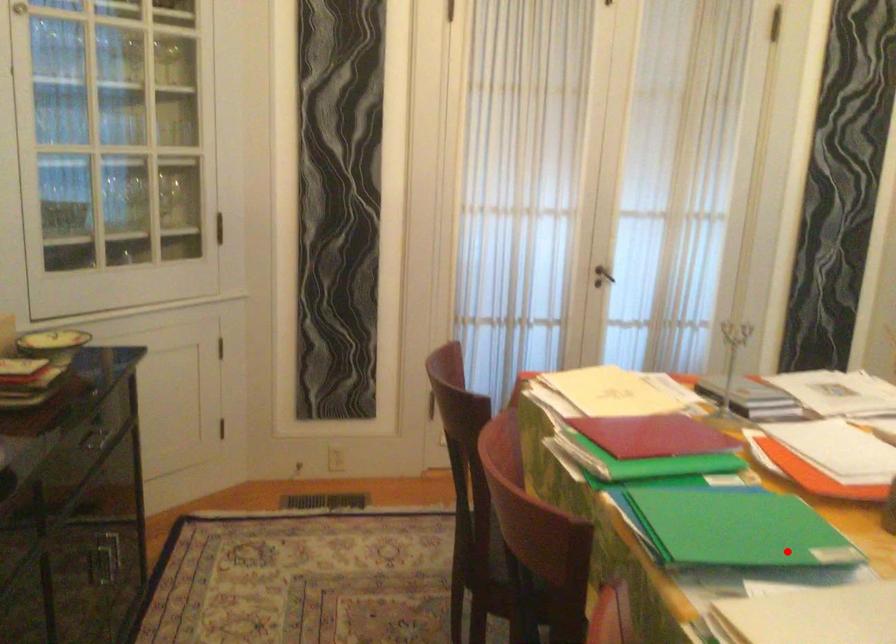
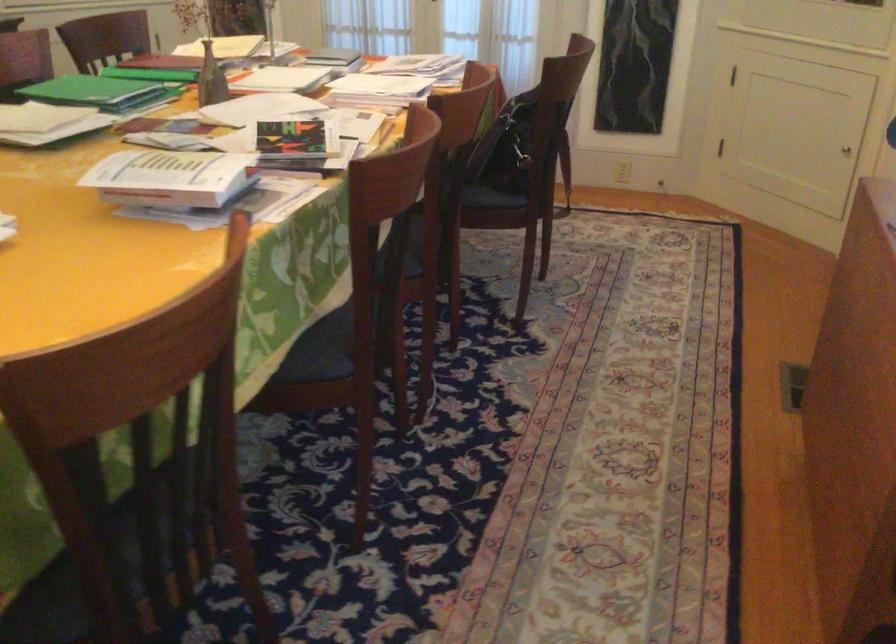
Question: I am providing you with two images of the same scene from different viewpoints. A red point is marked on the first image. Is the red point's position out of view in image 2?

Choices:
 (A) Yes
 (B) No

Answer: (B)